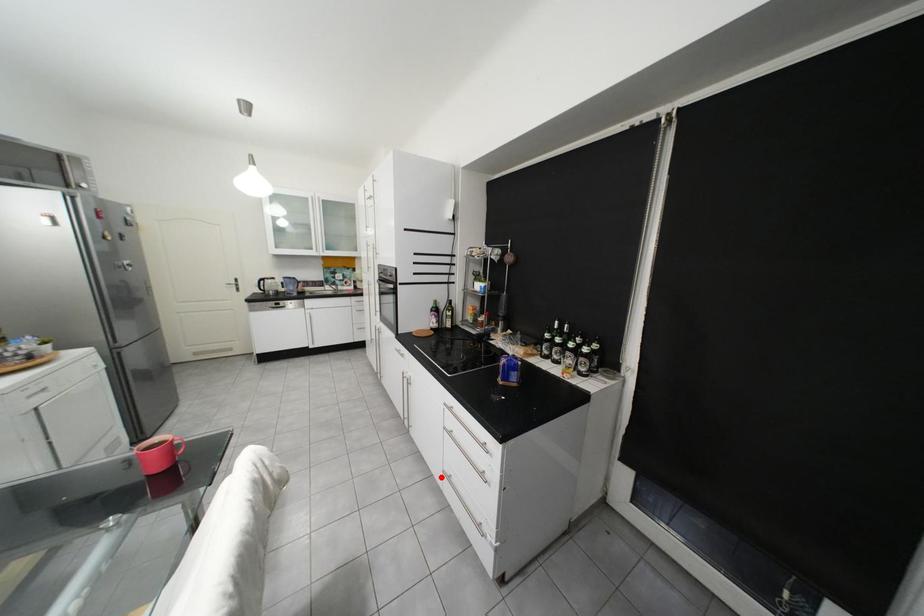
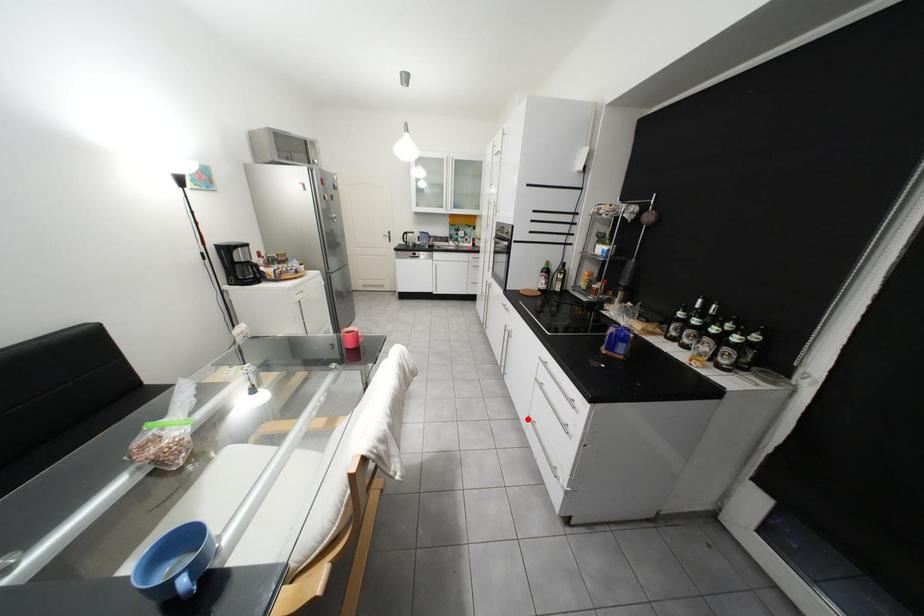
I am providing you with two images of the same scene from different viewpoints. A red point is marked on the first image and another point is marked on the second image. Is the marked point in image1 the same physical position as the marked point in image2?

Yes